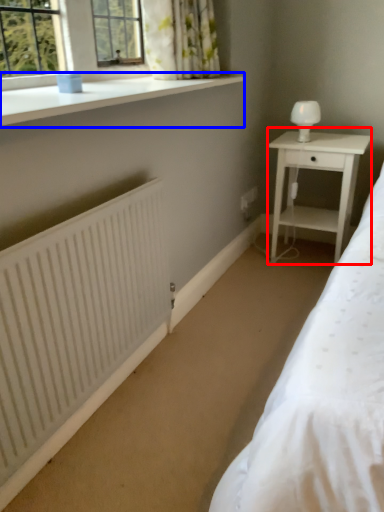
Question: Which object is closer to the camera taking this photo, nightstand (highlighted by a red box) or window sill (highlighted by a blue box)?

Choices:
 (A) nightstand
 (B) window sill

Answer: (B)